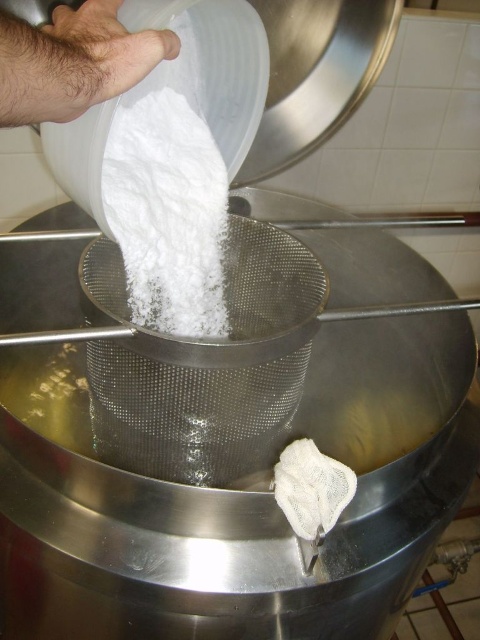
Question: Is the position of white powder at center less distant than that of hairy skin at upper left?

Choices:
 (A) yes
 (B) no

Answer: (B)

Question: Considering the relative positions of white powder at center and hairy skin at upper left in the image provided, where is white powder at center located with respect to hairy skin at upper left?

Choices:
 (A) above
 (B) below

Answer: (B)

Question: Which point appears farthest from the camera in this image?

Choices:
 (A) (168, 97)
 (B) (108, 54)

Answer: (A)

Question: Is white powder at center wider than hairy skin at upper left?

Choices:
 (A) yes
 (B) no

Answer: (A)